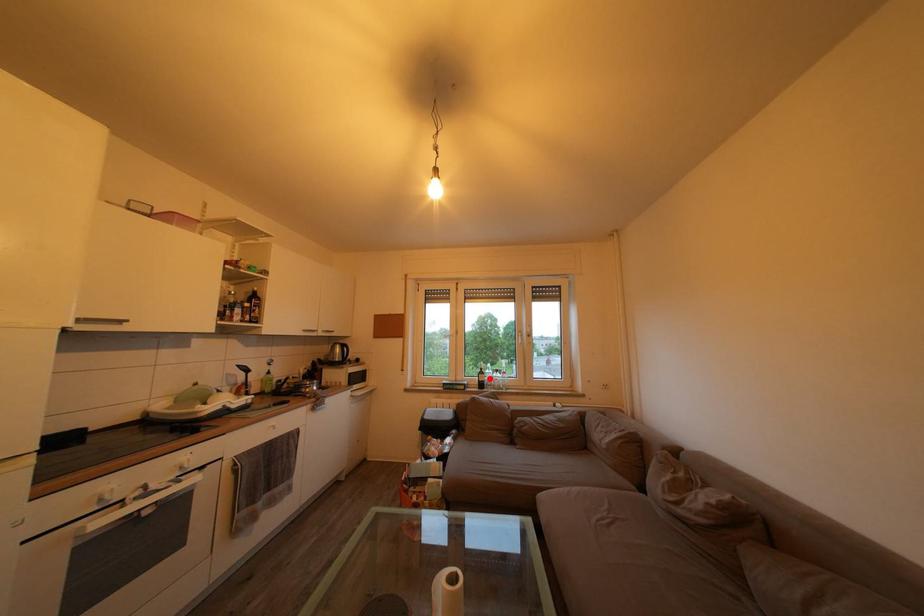
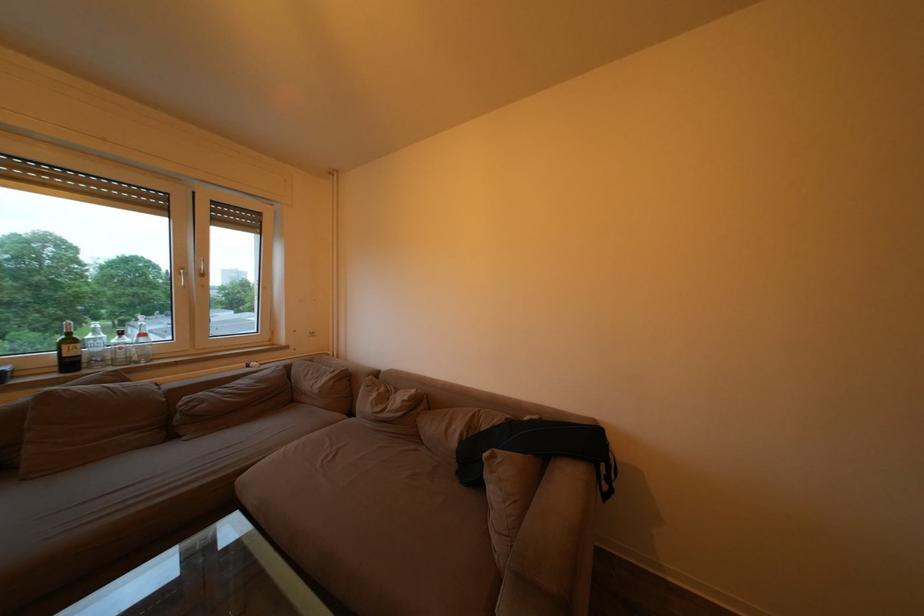
Find the pixel in the second image that matches the highlighted location in the first image.

(79, 347)